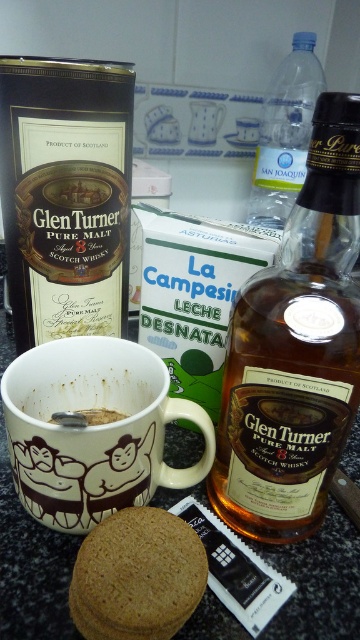
You are a barista preparing a drink and need to place both the brown textured biscuit at lower center and the clear plastic bottle at upper right on a shelf. The shelf has a height limit of 10 cm. Can both items fit vertically without exceeding the height limit?

The brown textured biscuit at lower center has a lesser height compared to the clear plastic bottle at upper right. Since the shelf has a height limit of 10 cm, both items can fit vertically as long as the taller clear plastic bottle at upper right is under 10 cm. However, without knowing the exact height of the bottle, we cannot confirm if it exceeds the limit. Please measure the bottle first.

You are a bartender preparing a cocktail and need to place the matte black bottle at center and the brown textured biscuit at lower center on a shelf that can only hold items up to the size of the bigger one. Which item should you place first to ensure both fit?

The matte black bottle at center is bigger than the brown textured biscuit at lower center, so you should place the matte black bottle at center first to ensure both items fit on the shelf.